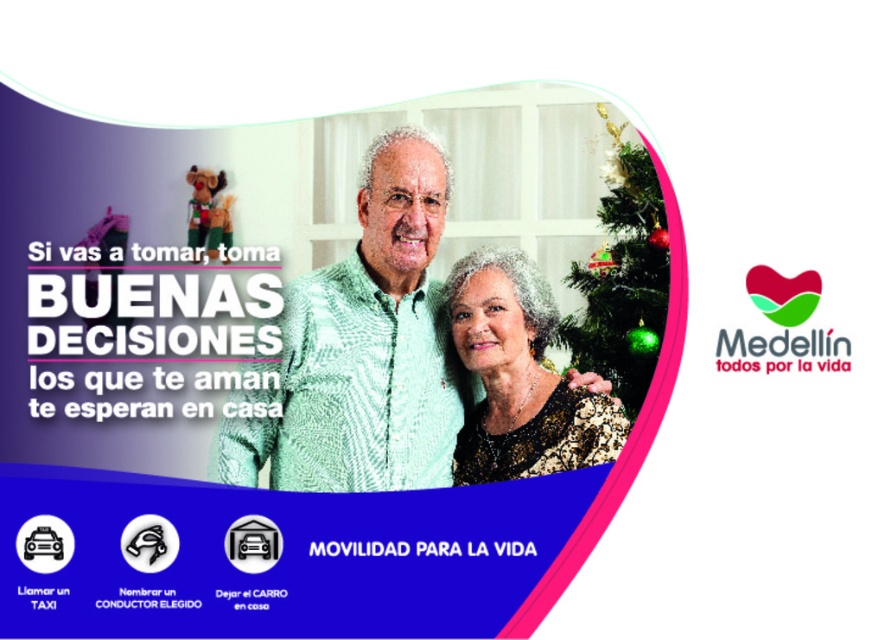
Question: Which point appears closest to the camera in this image?

Choices:
 (A) (426, 326)
 (B) (626, 332)

Answer: (B)

Question: Which point appears farthest from the camera in this image?

Choices:
 (A) (618, 448)
 (B) (632, 211)
 (C) (428, 380)

Answer: (C)

Question: Is green textured shirt at center further to the viewer compared to green shiny ornaments at upper right?

Choices:
 (A) no
 (B) yes

Answer: (A)

Question: Which object is closer to the camera taking this photo?

Choices:
 (A) green textured shirt at center
 (B) sparkly gold dress at center
 (C) green shiny ornaments at upper right

Answer: (A)

Question: Is green textured shirt at center positioned at the back of sparkly gold dress at center?

Choices:
 (A) yes
 (B) no

Answer: (B)

Question: Where is green textured shirt at center located in relation to sparkly gold dress at center in the image?

Choices:
 (A) left
 (B) right

Answer: (A)